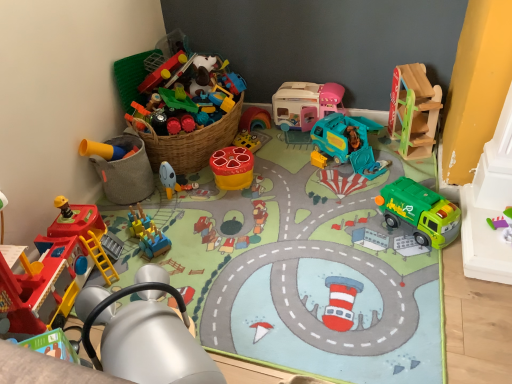
The image size is (512, 384). Identify the location of vacant space in front of pastel pink plastic camper at center, which ranks as the fourth toy in right-to-left order. (292, 150).